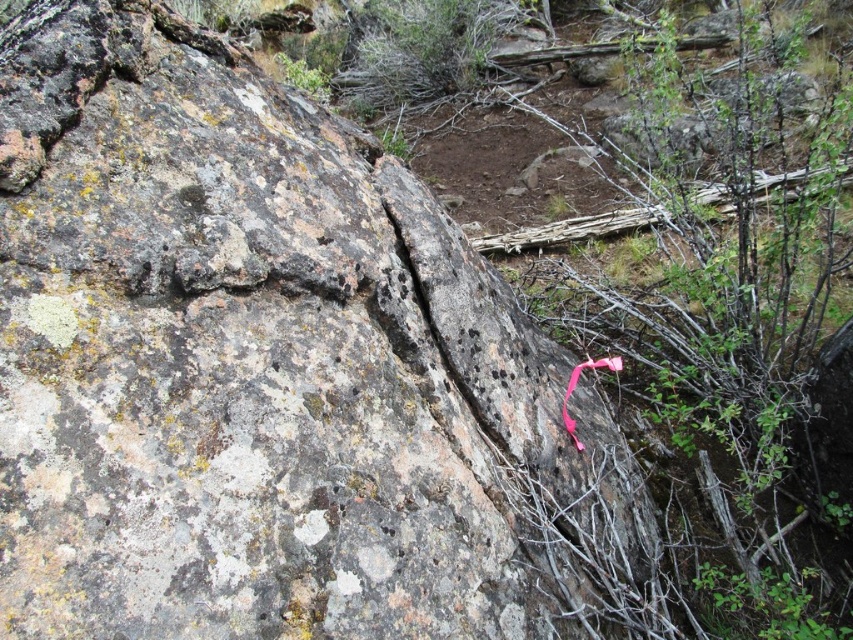
Who is more distant from viewer, (734, 10) or (564, 420)?

The point (734, 10) is behind.

Is pink fabric at center to the left of pink fabric ribbon at lower right from the viewer's perspective?

In fact, pink fabric at center is to the right of pink fabric ribbon at lower right.

This screenshot has width=853, height=640. What do you see at coordinates (737, 273) in the screenshot?
I see `pink fabric at center` at bounding box center [737, 273].

Locate an element on the screen. pink fabric at center is located at coordinates (737, 273).